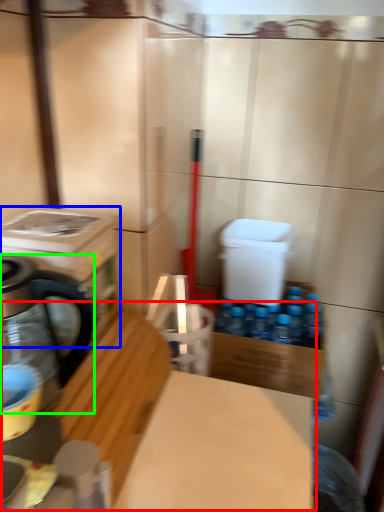
Question: Which object is the closest to the workbench (highlighted by a red box)? Choose among these: washing machine (highlighted by a blue box) or kitchen appliance (highlighted by a green box).

Choices:
 (A) washing machine
 (B) kitchen appliance

Answer: (B)